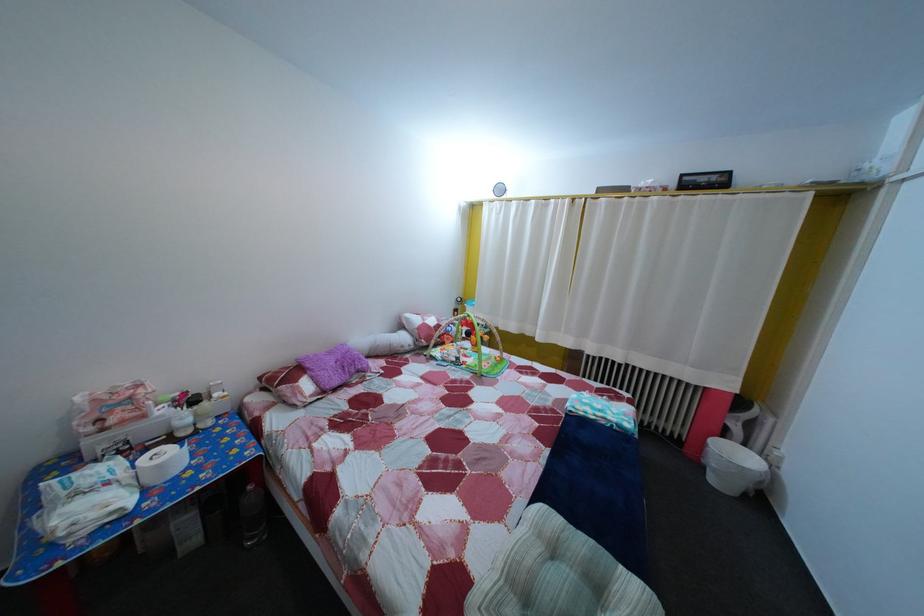
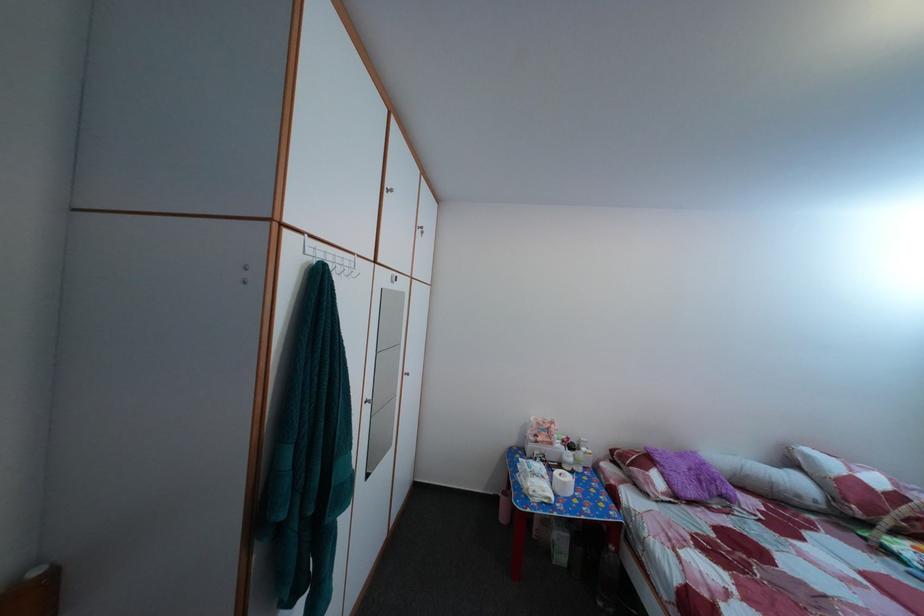
Locate, in the second image, the point that corresponds to pixel 411 354 in the first image.

(808, 504)